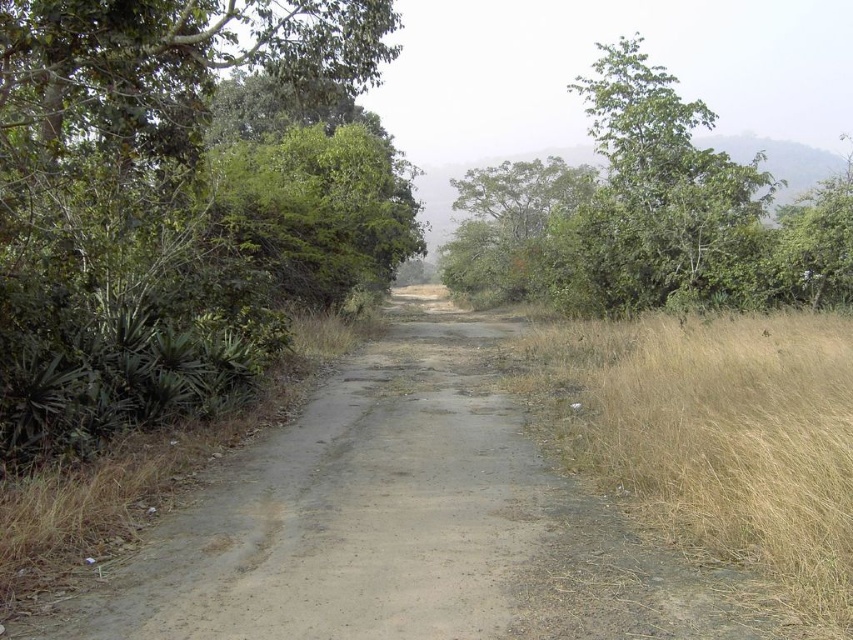
You are a hiker trying to navigate through the narrow road. You see the green leafy tree at left and the green leafy tree at upper center. Which tree is closer to you?

The green leafy tree at left is positioned under the green leafy tree at upper center, so the green leafy tree at upper center is closer to you.

You are a hiker planning to cross the narrow road in the scene. You notice the dry grass at right and the green leafy tree at upper center. Which of these two objects is closer to you, the observer?

The dry grass at right is smaller than the green leafy tree at upper center, so the dry grass at right is closer to you.

You are driving a car that is 1.8 meters wide. You need to navigate through the narrow road shown in the image. Considering the green leafy tree at left and dry grass at right, can your car safely pass through without hitting any obstacles?

The green leafy tree at left is located above dry grass at right, which means the tree is positioned higher than the grass. Since the car is 1.8 meters wide and the road is narrow, the vertical positioning of the tree does not affect the car width. The car can safely pass through as long as there are no horizontal obstacles blocking the road.